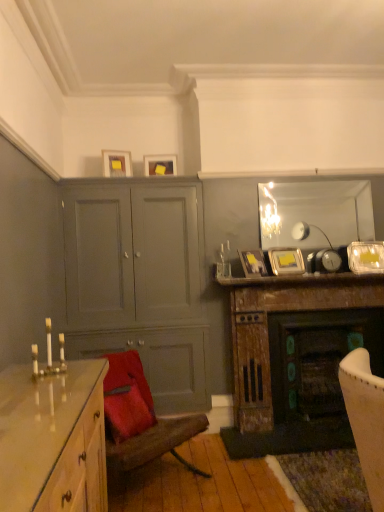
Where is `metallic silver mirror at upper center`? The image size is (384, 512). metallic silver mirror at upper center is located at coordinates (301, 280).

What do you see at coordinates (301, 280) in the screenshot? The width and height of the screenshot is (384, 512). I see `metallic silver mirror at upper center` at bounding box center [301, 280].

Measure the distance between metallic silver picture frame at upper right, which is counted as the third picture frame, starting from the top, and camera.

metallic silver picture frame at upper right, which is counted as the third picture frame, starting from the top, is 3.39 meters from camera.

The width and height of the screenshot is (384, 512). Describe the element at coordinates (160, 165) in the screenshot. I see `matte yellow picture frame at upper center, which is the second picture frame from top to bottom` at that location.

The width and height of the screenshot is (384, 512). Identify the location of velvet red chair at lower left. click(x=141, y=419).

At what (x,y) coordinates should I click in order to perform the action: click on clear glass mirror at upper center. Please return your answer as a coordinate pair (x, y). Looking at the image, I should click on (318, 212).

Does point (136, 417) lie behind point (53, 370)?

Yes.

Considering the relative sizes of velvet red pillow at lower left and gold metallic candle holder at left in the image provided, is velvet red pillow at lower left taller than gold metallic candle holder at left?

Yes, velvet red pillow at lower left is taller than gold metallic candle holder at left.

Does velvet red pillow at lower left appear on the left side of gold metallic candle holder at left?

In fact, velvet red pillow at lower left is to the right of gold metallic candle holder at left.

Which object is wider, metallic silver picture frame at upper right, the third picture frame positioned from the bottom, or velvet red pillow at lower left?

velvet red pillow at lower left.

Which is in front, point (375, 252) or point (123, 376)?

The point (123, 376) is closer.

Can you confirm if metallic silver picture frame at upper right, which is counted as the third picture frame, starting from the top, is smaller than velvet red pillow at lower left?

Yes, metallic silver picture frame at upper right, which is counted as the third picture frame, starting from the top, is smaller than velvet red pillow at lower left.

Are metallic silver picture frame at upper right, the 1th picture frame viewed from the right, and velvet red pillow at lower left located far from each other?

Yes, metallic silver picture frame at upper right, the 1th picture frame viewed from the right, is far from velvet red pillow at lower left.

Can we say matte black picture frame at upper center, arranged as the 3th picture frame when viewed from the right, lies outside matte yellow picture frame at upper center, placed as the fourth picture frame when sorted from right to left?

That's correct, matte black picture frame at upper center, arranged as the 3th picture frame when viewed from the right, is outside of matte yellow picture frame at upper center, placed as the fourth picture frame when sorted from right to left.

From the image's perspective, which is below, matte black picture frame at upper center, which is counted as the 1th picture frame, starting from the bottom, or matte yellow picture frame at upper center, placed as the fourth picture frame when sorted from right to left?

matte black picture frame at upper center, which is counted as the 1th picture frame, starting from the bottom.

Considering the positions of objects matte black picture frame at upper center, arranged as the third picture frame when viewed from the left, and matte yellow picture frame at upper center, placed as the fourth picture frame when sorted from right to left, in the image provided, who is more to the left, matte black picture frame at upper center, arranged as the third picture frame when viewed from the left, or matte yellow picture frame at upper center, placed as the fourth picture frame when sorted from right to left,?

matte yellow picture frame at upper center, placed as the fourth picture frame when sorted from right to left, is more to the left.

Considering their positions, is matte black picture frame at upper center, arranged as the 3th picture frame when viewed from the right, located in front of or behind matte yellow picture frame at upper center, placed as the fourth picture frame when sorted from right to left?

Visually, matte black picture frame at upper center, arranged as the 3th picture frame when viewed from the right, is located in front of matte yellow picture frame at upper center, placed as the fourth picture frame when sorted from right to left.

Is velvet red chair at lower left wider than metallic silver picture frame at upper center, the fourth picture frame positioned from the top?

Yes.

In terms of height, does velvet red chair at lower left look taller or shorter compared to metallic silver picture frame at upper center, acting as the second picture frame starting from the bottom?

In the image, velvet red chair at lower left appears to be taller than metallic silver picture frame at upper center, acting as the second picture frame starting from the bottom.

In the scene shown: How different are the orientations of velvet red chair at lower left and metallic silver picture frame at upper center, which ranks as the 4th picture frame in left-to-right order, in degrees?

32.9 degrees separate the facing orientations of velvet red chair at lower left and metallic silver picture frame at upper center, which ranks as the 4th picture frame in left-to-right order.

Between velvet red chair at lower left and metallic silver picture frame at upper center, which ranks as the 4th picture frame in left-to-right order, which one appears on the right side from the viewer's perspective?

metallic silver picture frame at upper center, which ranks as the 4th picture frame in left-to-right order.

Considering the positions of objects matte yellow picture frame at upper center, which is the first picture frame in left-to-right order, and metallic silver mirror at upper center in the image provided, who is more to the left, matte yellow picture frame at upper center, which is the first picture frame in left-to-right order, or metallic silver mirror at upper center?

matte yellow picture frame at upper center, which is the first picture frame in left-to-right order.

Considering the relative sizes of matte yellow picture frame at upper center, the 5th picture frame from the bottom, and metallic silver mirror at upper center in the image provided, is matte yellow picture frame at upper center, the 5th picture frame from the bottom, thinner than metallic silver mirror at upper center?

Indeed, matte yellow picture frame at upper center, the 5th picture frame from the bottom, has a lesser width compared to metallic silver mirror at upper center.

Considering the sizes of objects matte yellow picture frame at upper center, which is the first picture frame in left-to-right order, and metallic silver mirror at upper center in the image provided, who is taller, matte yellow picture frame at upper center, which is the first picture frame in left-to-right order, or metallic silver mirror at upper center?

matte yellow picture frame at upper center, which is the first picture frame in left-to-right order.

How far apart are matte yellow picture frame at upper center, placed as the 5th picture frame when sorted from right to left, and metallic silver mirror at upper center?

They are 5.16 feet apart.

Consider the image. Is metallic silver picture frame at upper right, which ranks as the fifth picture frame in left-to-right order, facing towards metallic silver picture frame at upper center, acting as the second picture frame starting from the bottom?

No.

Choose the correct answer: Is metallic silver picture frame at upper right, which is counted as the third picture frame, starting from the top, inside metallic silver picture frame at upper center, acting as the second picture frame starting from the bottom, or outside it?

metallic silver picture frame at upper right, which is counted as the third picture frame, starting from the top, exists outside the volume of metallic silver picture frame at upper center, acting as the second picture frame starting from the bottom.

Which object is closer to the camera, metallic silver picture frame at upper right, which is counted as the third picture frame, starting from the top, or metallic silver picture frame at upper center, the fourth picture frame positioned from the top?

metallic silver picture frame at upper center, the fourth picture frame positioned from the top, is in front.

Considering the positions of objects metallic silver picture frame at upper right, the 1th picture frame viewed from the right, and metallic silver picture frame at upper center, the fourth picture frame positioned from the top, in the image provided, who is more to the right, metallic silver picture frame at upper right, the 1th picture frame viewed from the right, or metallic silver picture frame at upper center, the fourth picture frame positioned from the top,?

metallic silver picture frame at upper right, the 1th picture frame viewed from the right.

Looking at their sizes, would you say gold metallic candle holder at left is wider or thinner than glossy wood chest of drawers at lower left?

Considering their sizes, gold metallic candle holder at left looks slimmer than glossy wood chest of drawers at lower left.

Is gold metallic candle holder at left oriented towards glossy wood chest of drawers at lower left?

No, gold metallic candle holder at left does not turn towards glossy wood chest of drawers at lower left.

Which object is positioned more to the left, gold metallic candle holder at left or glossy wood chest of drawers at lower left?

gold metallic candle holder at left.

Which object is closer to the camera, gold metallic candle holder at left or glossy wood chest of drawers at lower left?

glossy wood chest of drawers at lower left is in front.

Identify the location of pillow below the gold metallic candle holder at left (from the image's perspective). (126, 407).

From the image's perspective, which picture frame is the 3rd one above the velvet red pillow at lower left? Please provide its 2D coordinates.

[(366, 257)]

Looking at this image, estimate the real-world distances between objects in this image. Which object is closer to velvet red chair at lower left, metallic silver mirror at upper center or gold metallic candle holder at left?

gold metallic candle holder at left is positioned closer to the anchor velvet red chair at lower left.

Which object lies further to the anchor point metallic silver picture frame at upper right, which ranks as the fifth picture frame in left-to-right order, matte yellow picture frame at upper center, which is the second picture frame from top to bottom, or gold metallic candle holder at left?

gold metallic candle holder at left.

Looking at the image, which one is located further to gold metallic candle holder at left, matte gray cabinet at center-left or metallic silver mirror at upper center?

metallic silver mirror at upper center is positioned further to the anchor gold metallic candle holder at left.

Based on their spatial positions, is velvet red pillow at lower left or matte gray cabinet at center-left further from clear glass mirror at upper center?

Based on the image, velvet red pillow at lower left appears to be further to clear glass mirror at upper center.

When comparing their distances from metallic silver picture frame at upper right, the third picture frame positioned from the bottom, does clear glass mirror at upper center or matte yellow picture frame at upper center, which is the first picture frame in left-to-right order, seem closer?

Based on the image, clear glass mirror at upper center appears to be nearer to metallic silver picture frame at upper right, the third picture frame positioned from the bottom.

From the image, which object appears to be nearer to metallic silver picture frame at upper center, acting as the second picture frame starting from the bottom, clear glass mirror at upper center or matte yellow picture frame at upper center, which is the second picture frame from top to bottom?

The object closer to metallic silver picture frame at upper center, acting as the second picture frame starting from the bottom, is clear glass mirror at upper center.

Looking at the image, which one is located closer to matte yellow picture frame at upper center, placed as the 4th picture frame when sorted from bottom to top, matte black picture frame at upper center, arranged as the third picture frame when viewed from the left, or metallic silver mirror at upper center?

The object closer to matte yellow picture frame at upper center, placed as the 4th picture frame when sorted from bottom to top, is matte black picture frame at upper center, arranged as the third picture frame when viewed from the left.

Estimate the real-world distances between objects in this image. Which object is closer to metallic silver picture frame at upper right, which is counted as the third picture frame, starting from the top, gold metallic candle holder at left or matte gray cabinet at center-left?

Among the two, matte gray cabinet at center-left is located nearer to metallic silver picture frame at upper right, which is counted as the third picture frame, starting from the top.

What are the coordinates of `candle holder between matte yellow picture frame at upper center, placed as the 5th picture frame when sorted from right to left, and metallic silver picture frame at upper right, which ranks as the fifth picture frame in left-to-right order` in the screenshot? It's located at (49, 355).

The height and width of the screenshot is (512, 384). Identify the location of mantle located between gold metallic candle holder at left and metallic silver picture frame at upper center, acting as the second picture frame starting from the bottom, in the depth direction. (301, 280).

Where is `candle holder positioned between glossy wood chest of drawers at lower left and matte yellow picture frame at upper center, placed as the fourth picture frame when sorted from right to left, from near to far`? The height and width of the screenshot is (512, 384). candle holder positioned between glossy wood chest of drawers at lower left and matte yellow picture frame at upper center, placed as the fourth picture frame when sorted from right to left, from near to far is located at coordinates (49, 355).

Locate an element on the screen. The height and width of the screenshot is (512, 384). chair between velvet red pillow at lower left and metallic silver mirror at upper center from left to right is located at coordinates (141, 419).